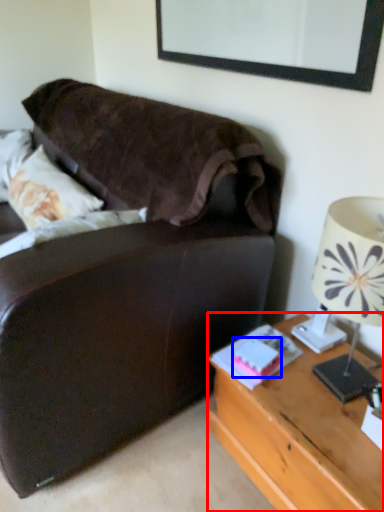
Question: Which object appears closest to the camera in this image, desk (highlighted by a red box) or book (highlighted by a blue box)?

Choices:
 (A) desk
 (B) book

Answer: (A)